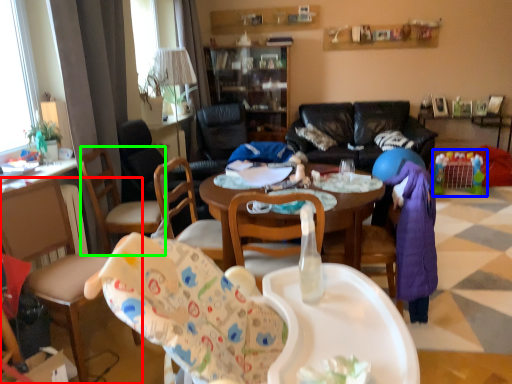
Question: Based on their relative distances, which object is nearer to chair (highlighted by a red box)? Choose from toy (highlighted by a blue box) and armchair (highlighted by a green box).

Choices:
 (A) toy
 (B) armchair

Answer: (B)